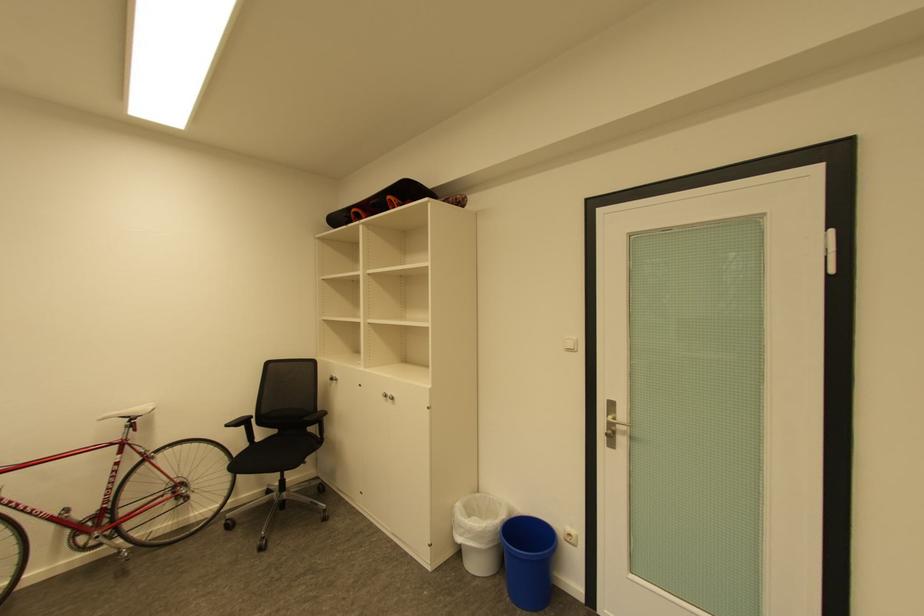
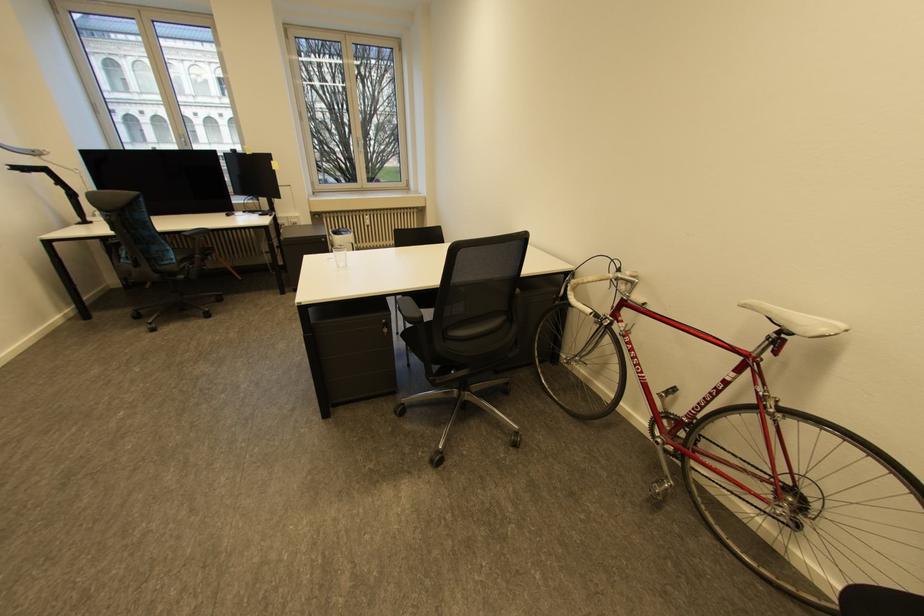
Find the pixel in the second image that matches point 139,419 in the first image.

(789, 331)